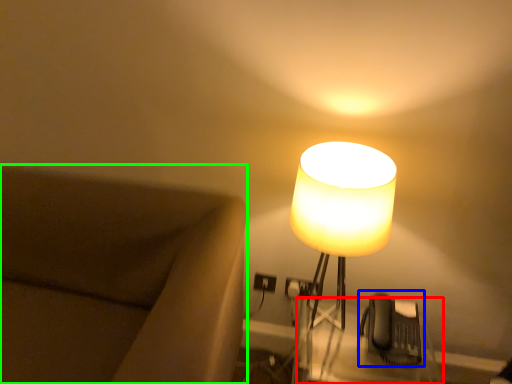
Question: Which is nearer to the table (highlighted by a red box)? swivel chair (highlighted by a blue box) or furniture (highlighted by a green box).

Choices:
 (A) swivel chair
 (B) furniture

Answer: (A)